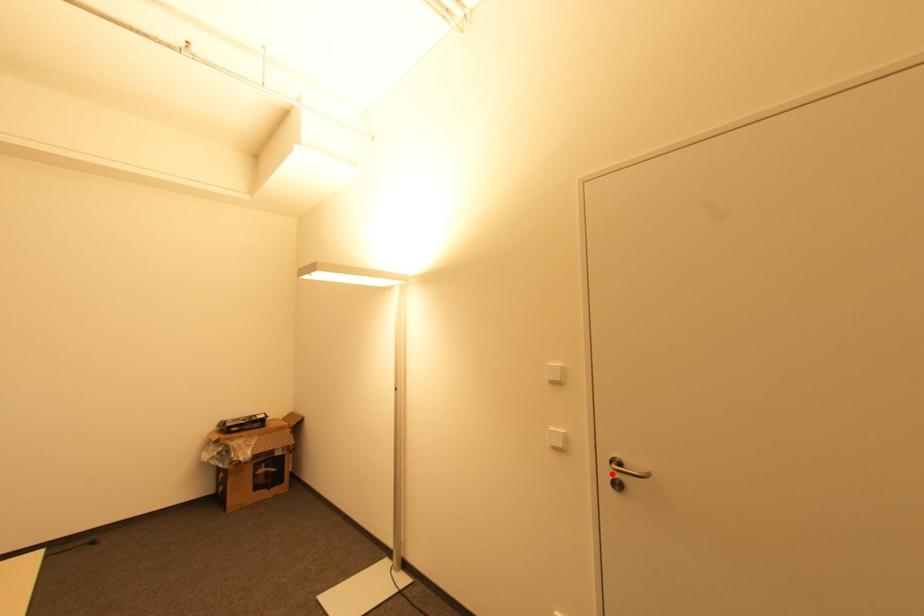
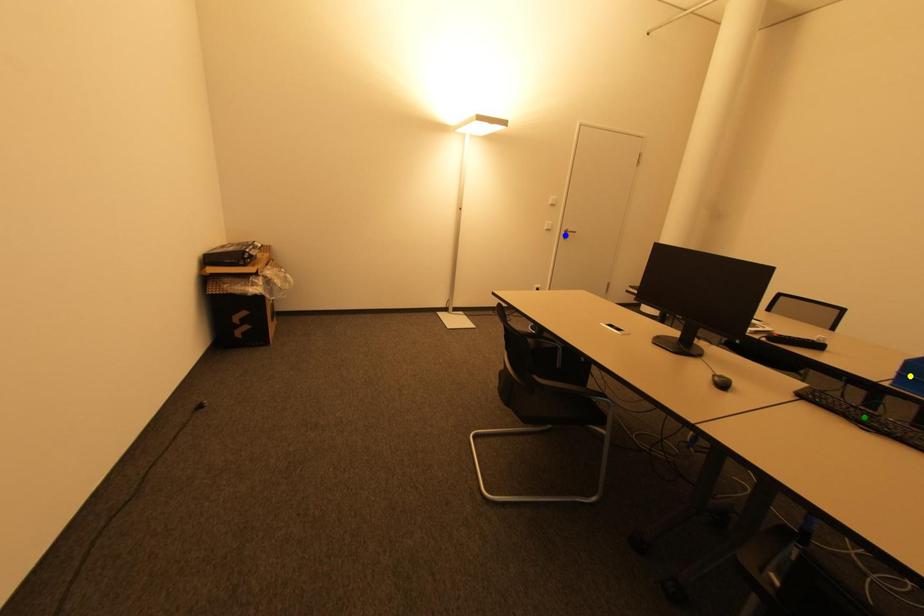
Question: I am providing you with two images of the same scene from different viewpoints. A red point is marked on the first image. You are given multiple points on the second image. In image 2, which mark is for the same physical point as the one in image 1?

Choices:
 (A) green point
 (B) yellow point
 (C) blue point

Answer: (C)